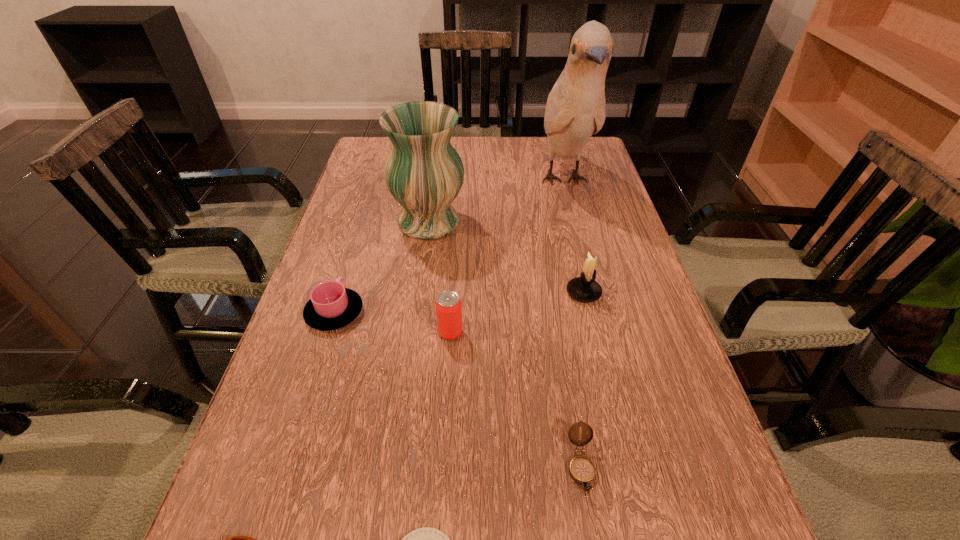
I want to click on object at the far right corner, so click(x=575, y=110).

Locate an element on the screen. vacant space at the far edge is located at coordinates (511, 172).

In the image, there is a desktop. Where is `free space at the left edge`? The width and height of the screenshot is (960, 540). free space at the left edge is located at coordinates (356, 201).

Locate an element on the screen. This screenshot has height=540, width=960. vacant space at the right edge of the desktop is located at coordinates (615, 253).

You are a GUI agent. You are given a task and a screenshot of the screen. Output one action in this format:
    pyautogui.click(x=<x>, y=<y>)
    Task: Click on the vacant region at the far left corner of the desktop
    The width and height of the screenshot is (960, 540).
    Given the screenshot: What is the action you would take?
    pyautogui.click(x=385, y=143)

At what (x,y) coordinates should I click in order to perform the action: click on free space between the second tallest object and the farthest compass. Please return your answer as a coordinate pair (x, y). The width and height of the screenshot is (960, 540). Looking at the image, I should click on (505, 344).

Where is `free point between the seventh shortest object and the candle holder`? The width and height of the screenshot is (960, 540). free point between the seventh shortest object and the candle holder is located at coordinates (506, 257).

At what (x,y) coordinates should I click in order to perform the action: click on vacant space that is in between the cup and the rightmost compass. Please return your answer as a coordinate pair (x, y). Image resolution: width=960 pixels, height=540 pixels. Looking at the image, I should click on (458, 389).

This screenshot has height=540, width=960. I want to click on vacant area that lies between the farthest compass and the second tallest object, so click(505, 344).

Identify the location of object that ranks as the third closest to the shortest compass. This screenshot has height=540, width=960. (448, 305).